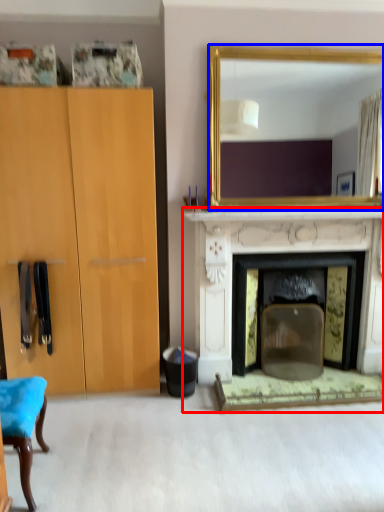
Question: Which point is closer to the camera, fireplace (highlighted by a red box) or mirror (highlighted by a blue box)?

Choices:
 (A) fireplace
 (B) mirror

Answer: (B)